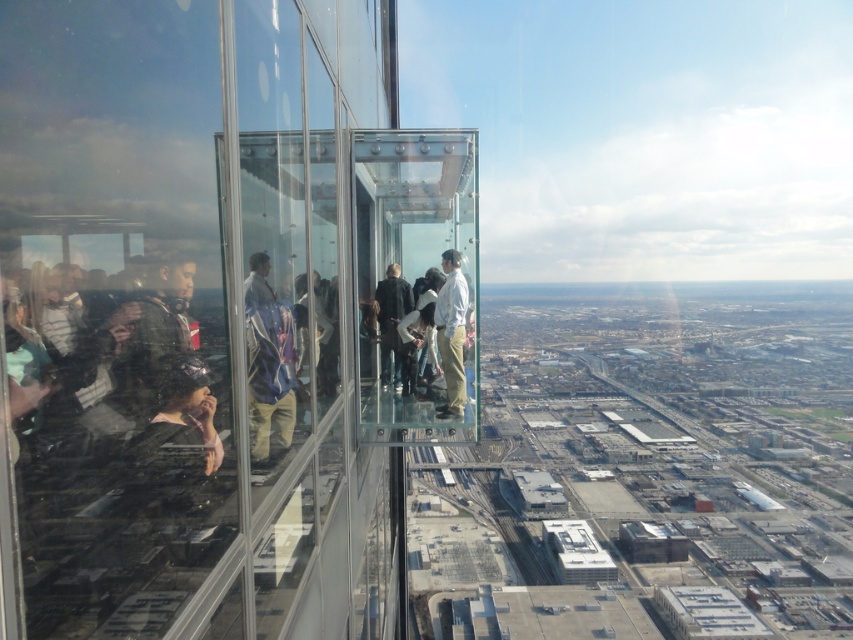
You are standing on a glass viewing platform of a skyscraper. You see a person wearing a light blue shirt at center. If you want to find the exact location of this person on the glass floor, where would you look?

The light blue shirt at center is located at the 2D coordinates point [451,332] on the glass floor.